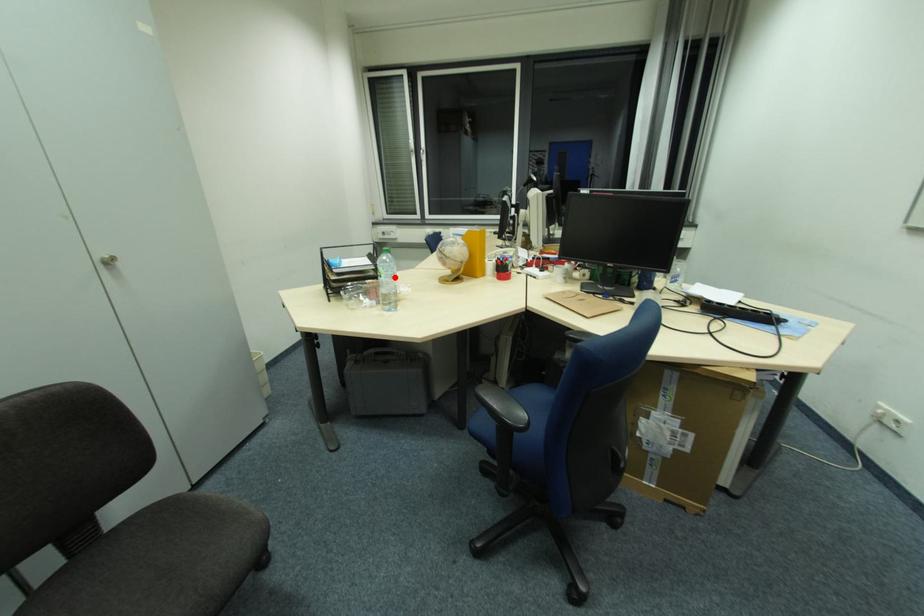
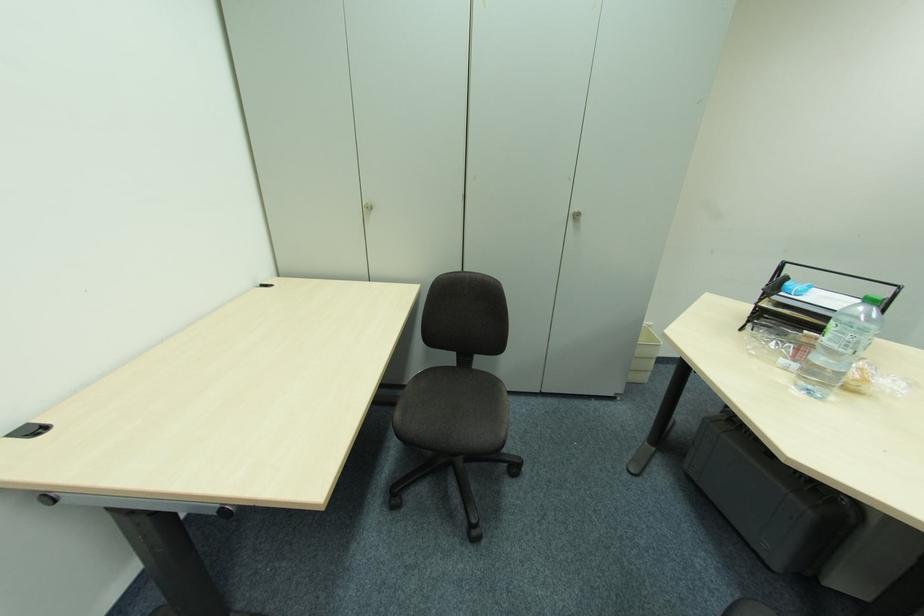
Where in the second image is the point corresponding to the highlighted location from the first image?

(850, 347)